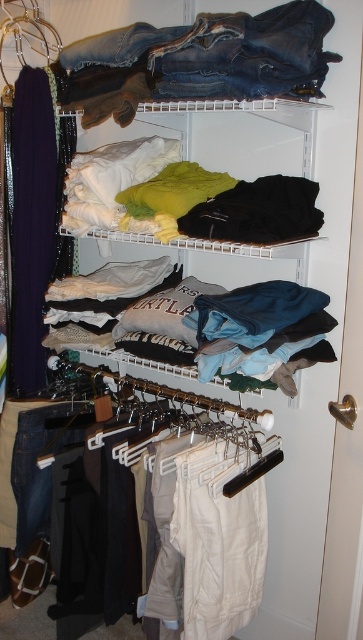
Is denim jeans at upper center closer to the viewer compared to light gray cotton t-shirt at center?

That is True.

Is denim jeans at upper center further to camera compared to light gray cotton t-shirt at center?

No.

Which is behind, point (320, 84) or point (278, 352)?

The point (320, 84) is behind.

What are the coordinates of `denim jeans at upper center` in the screenshot? It's located at (209, 56).